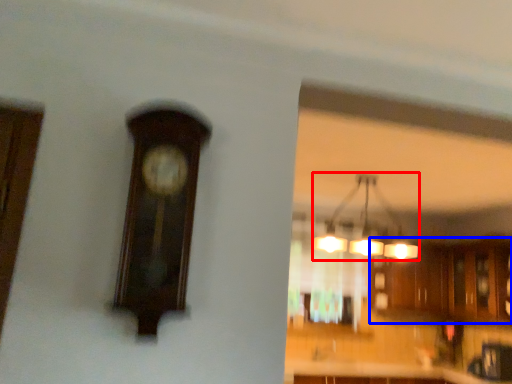
Question: Which point is closer to the camera, lamp (highlighted by a red box) or cabinetry (highlighted by a blue box)?

Choices:
 (A) lamp
 (B) cabinetry

Answer: (A)